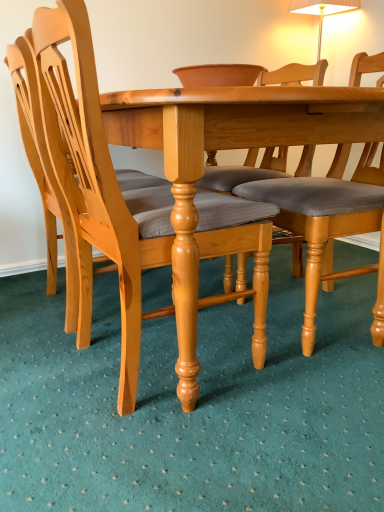
Question: From a real-world perspective, is light wood chair at left, which is counted as the 1th chair, starting from the left, physically located above or below light brown wood chair at center, the 3th chair when ordered from left to right?

Choices:
 (A) below
 (B) above

Answer: (B)

Question: Considering the positions of point (16, 48) and point (380, 68), is point (16, 48) closer or farther from the camera than point (380, 68)?

Choices:
 (A) farther
 (B) closer

Answer: (B)

Question: Based on their relative distances, which object is nearer to the light wood chair at left, the third chair when ordered from right to left?

Choices:
 (A) light brown wood chair at left, acting as the second chair starting from the left
 (B) light brown wood chair at center, the 3th chair when ordered from left to right

Answer: (A)

Question: Estimate the real-world distances between objects in this image. Which object is farther from the light wood chair at left, which is counted as the 1th chair, starting from the left?

Choices:
 (A) light brown wood chair at left, acting as the second chair starting from the left
 (B) light brown wood chair at center, the 3th chair when ordered from left to right

Answer: (B)